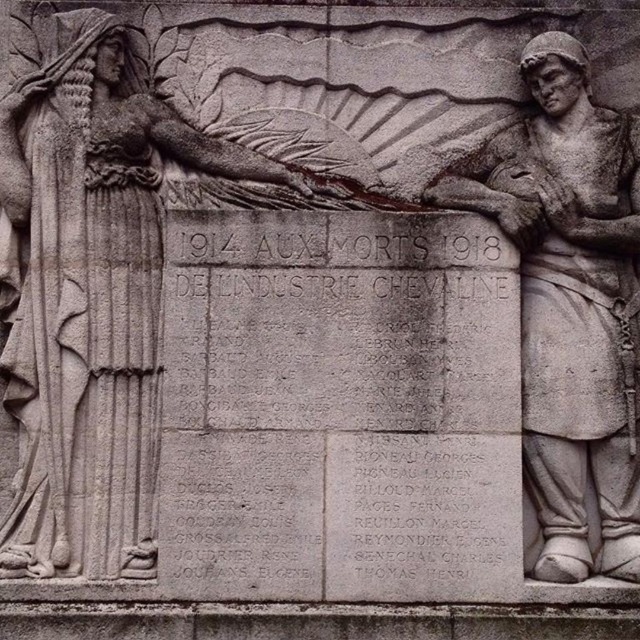
What is the spatial relationship between the gray stone statue at left and the gray stone soldier at right in the sculpture?

The gray stone statue at left is positioned to the left of the gray stone soldier at right.

You are an art restorer examining the stone relief sculpture. You need to determine which of the two points, point (45, 92) or point (611, 224), is closer to the viewer. Based on the description, which point is closer?

Point (45, 92) is closer to the viewer than point (611, 224).

What is the location of the point with coordinates (92, 296) in the image?

The point with coordinates (92, 296) is located on the gray stone statue at left.